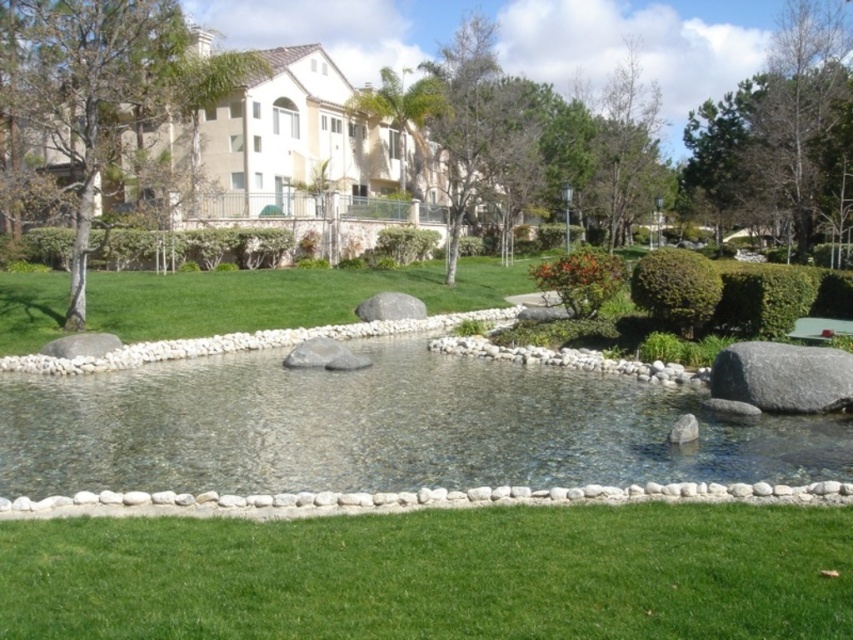
Can you confirm if clear glass water at center is taller than green leafy tree at upper right?

No.

Is clear glass water at center to the left of green leafy tree at upper right from the viewer's perspective?

Yes, clear glass water at center is to the left of green leafy tree at upper right.

At what (x,y) coordinates should I click in order to perform the action: click on clear glass water at center. Please return your answer as a coordinate pair (x, y). The width and height of the screenshot is (853, 640). Looking at the image, I should click on (381, 428).

Identify the location of clear glass water at center. The image size is (853, 640). (381, 428).

Who is more distant from viewer, (16, 60) or (776, 77)?

The point (776, 77) is behind.

Can you confirm if brown textured tree at upper left is smaller than green leafy tree at upper right?

Yes.

At what (x,y) coordinates should I click in order to perform the action: click on brown textured tree at upper left. Please return your answer as a coordinate pair (x, y). The width and height of the screenshot is (853, 640). Looking at the image, I should click on (106, 88).

Looking at this image, is green grass at lower center to the left of green leafy tree at upper right from the viewer's perspective?

Yes, green grass at lower center is to the left of green leafy tree at upper right.

Is point (585, 612) less distant than point (732, 124)?

Yes, point (585, 612) is in front of point (732, 124).

Find the location of a particular element. green grass at lower center is located at coordinates (436, 573).